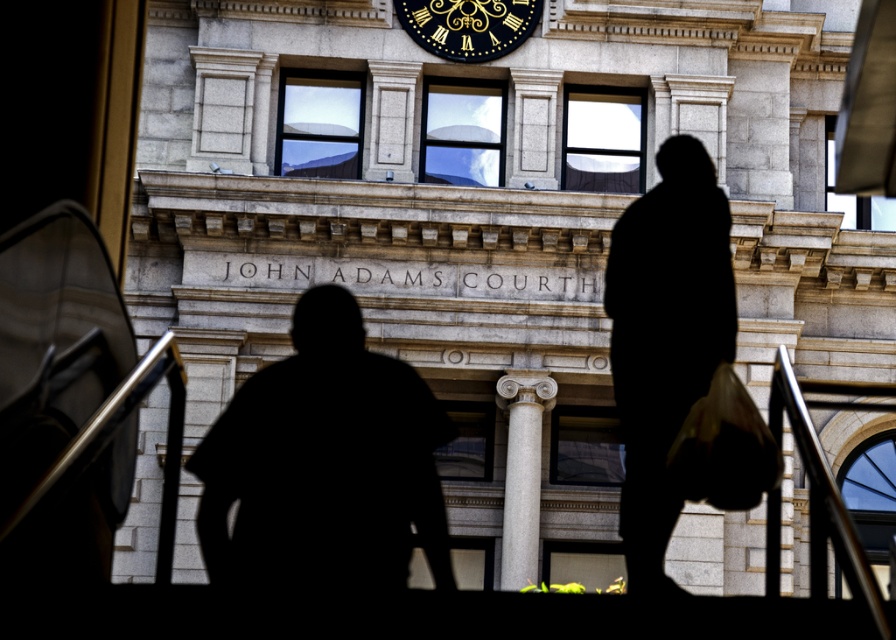
Question: Which object is closer to the camera taking this photo?

Choices:
 (A) black-golden clock at upper center
 (B) gray stone column at center
 (C) black silhouette at center
 (D) black fabric bag at center

Answer: (C)

Question: Does gray stone column at center appear over black-golden clock at upper center?

Choices:
 (A) no
 (B) yes

Answer: (A)

Question: Is black silhouette at center positioned behind gray stone column at center?

Choices:
 (A) yes
 (B) no

Answer: (B)

Question: Which object is farther from the camera taking this photo?

Choices:
 (A) black-golden clock at upper center
 (B) gray stone column at center

Answer: (A)

Question: Which point is closer to the camera?

Choices:
 (A) (530, 516)
 (B) (408, 26)

Answer: (A)

Question: Where is black fabric bag at center located in relation to black-golden clock at upper center in the image?

Choices:
 (A) left
 (B) right

Answer: (B)